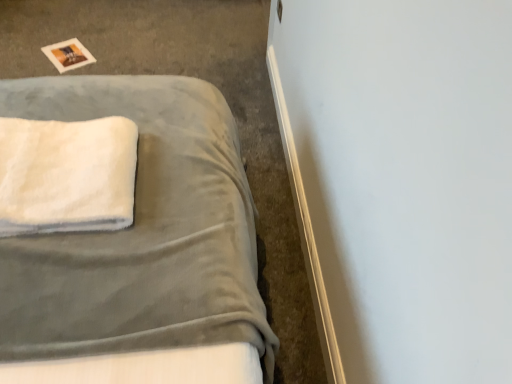
Question: Is point (36, 218) positioned closer to the camera than point (76, 241)?

Choices:
 (A) farther
 (B) closer

Answer: (A)

Question: Is white fluffy towel at upper left to the left or to the right of suede gray bed at upper left in the image?

Choices:
 (A) right
 (B) left

Answer: (A)

Question: From the image's perspective, relative to suede gray bed at upper left, is white fluffy towel at upper left above or below?

Choices:
 (A) below
 (B) above

Answer: (A)

Question: From a real-world perspective, is suede gray bed at upper left positioned above or below white fluffy towel at upper left?

Choices:
 (A) above
 (B) below

Answer: (B)

Question: From their relative heights in the image, would you say suede gray bed at upper left is taller or shorter than white fluffy towel at upper left?

Choices:
 (A) short
 (B) tall

Answer: (A)

Question: Is point (156, 162) closer or farther from the camera than point (52, 180)?

Choices:
 (A) closer
 (B) farther

Answer: (B)

Question: Based on their sizes in the image, would you say suede gray bed at upper left is bigger or smaller than white fluffy towel at upper left?

Choices:
 (A) big
 (B) small

Answer: (A)